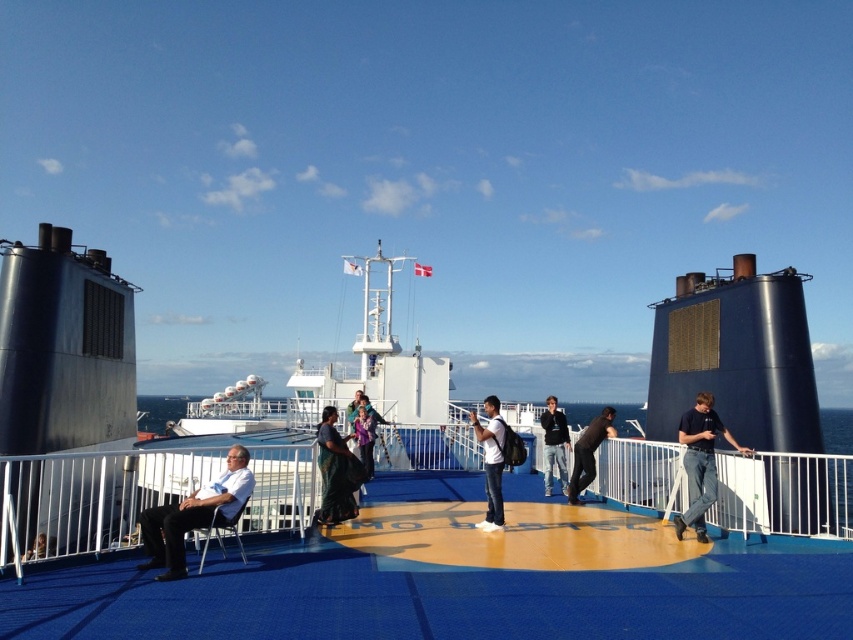
Who is more distant from viewer, [27,353] or [495,440]?

The point [27,353] is more distant.

This screenshot has height=640, width=853. What do you see at coordinates (331, 532) in the screenshot?
I see `blue matte boat at center` at bounding box center [331, 532].

The height and width of the screenshot is (640, 853). What do you see at coordinates (331, 532) in the screenshot?
I see `blue matte boat at center` at bounding box center [331, 532].

Where is `blue matte boat at center`? blue matte boat at center is located at coordinates (331, 532).

Does white fabric chair at lower left appear on the left side of metallic blue chair at lower left?

Indeed, white fabric chair at lower left is positioned on the left side of metallic blue chair at lower left.

In the scene shown: Which is below, white fabric chair at lower left or metallic blue chair at lower left?

Positioned lower is metallic blue chair at lower left.

Which is in front, point (154, 513) or point (218, 529)?

Positioned in front is point (154, 513).

The width and height of the screenshot is (853, 640). I want to click on white fabric chair at lower left, so click(x=194, y=515).

Does white fabric chair at lower left appear under silky green sari at center?

Yes, white fabric chair at lower left is below silky green sari at center.

Is white fabric chair at lower left wider than silky green sari at center?

Yes.

Is point (219, 500) farther from camera compared to point (317, 429)?

No, (219, 500) is closer to viewer.

The height and width of the screenshot is (640, 853). What are the coordinates of `white fabric chair at lower left` in the screenshot? It's located at (194, 515).